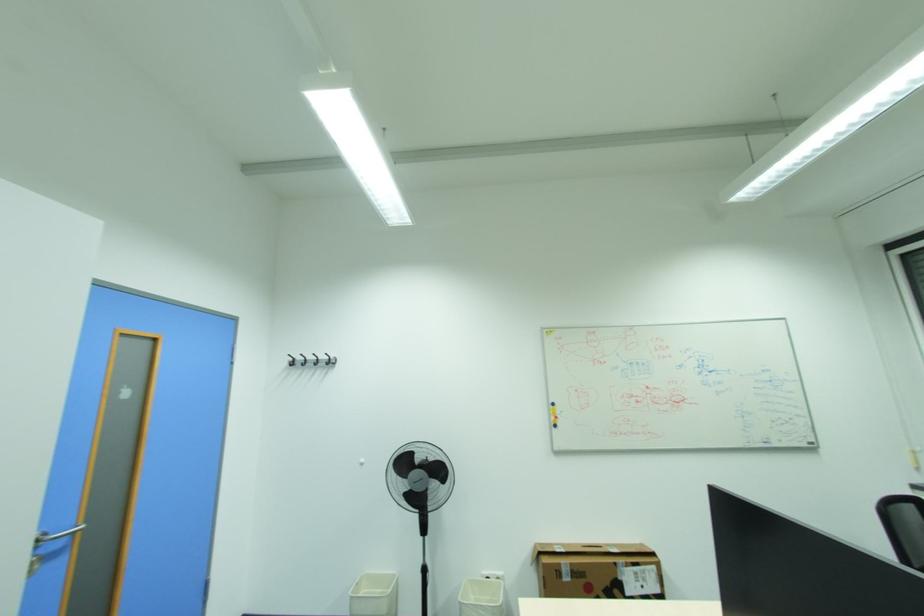
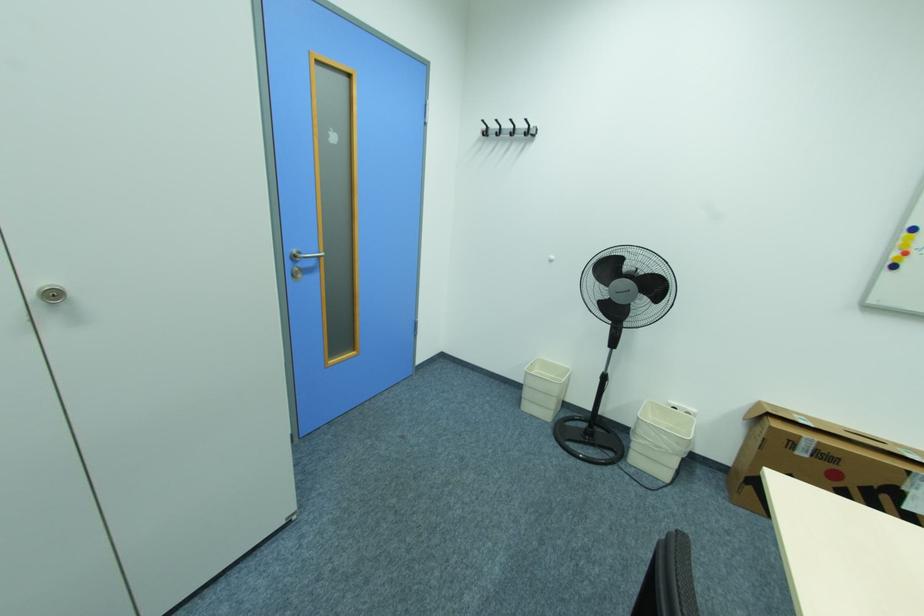
Where in the second image is the point corresponding to the point at 562,418 from the first image?

(910, 253)